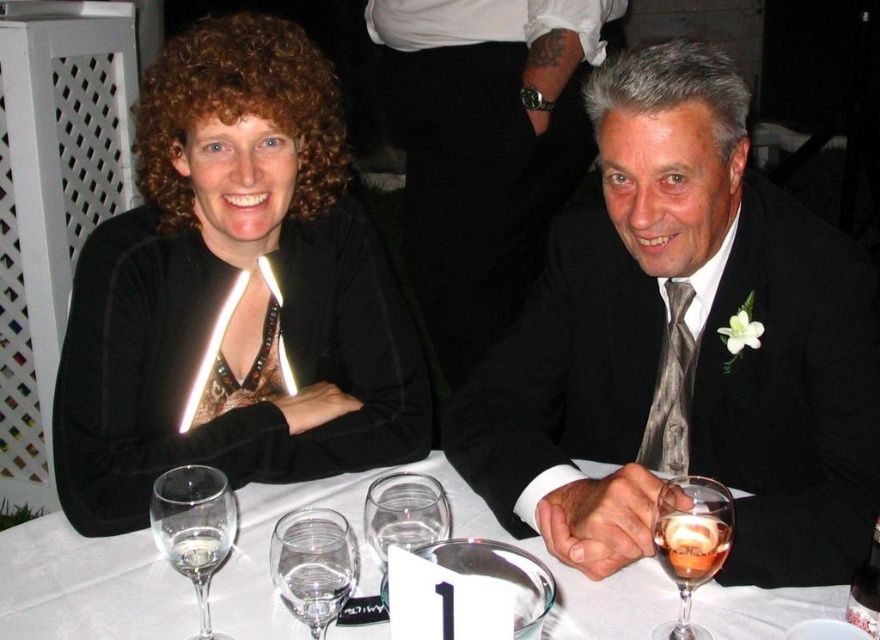
You are a waiter at a wedding reception and need to place a dessert plate on the table. The dessert plate is 12 inches in diameter. The table has a white tablecloth and there is a clear glass wine glass at lower left located at point (x=194, y=529). Where should you place the dessert plate so that it doesn t knock over the wine glass?

Place the dessert plate away from the clear glass wine glass at lower left located at point (x=194, y=529) to prevent it from being knocked over.

You are a server at a wedding reception and need to pour wine into the clear glass wine at center and the transparent glass wine glass at center. Which glass should you fill first if you want to avoid overfilling the shorter one?

The transparent glass wine glass at center is shorter than the clear glass wine at center. To avoid overfilling the shorter one, you should fill the transparent glass wine glass at center first.